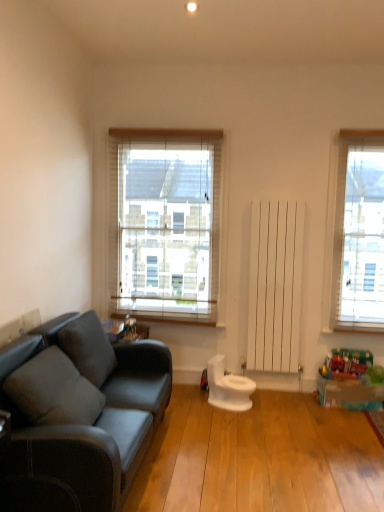
This screenshot has height=512, width=384. I want to click on vacant area that lies to the right of white glossy toilet at center, so click(x=268, y=407).